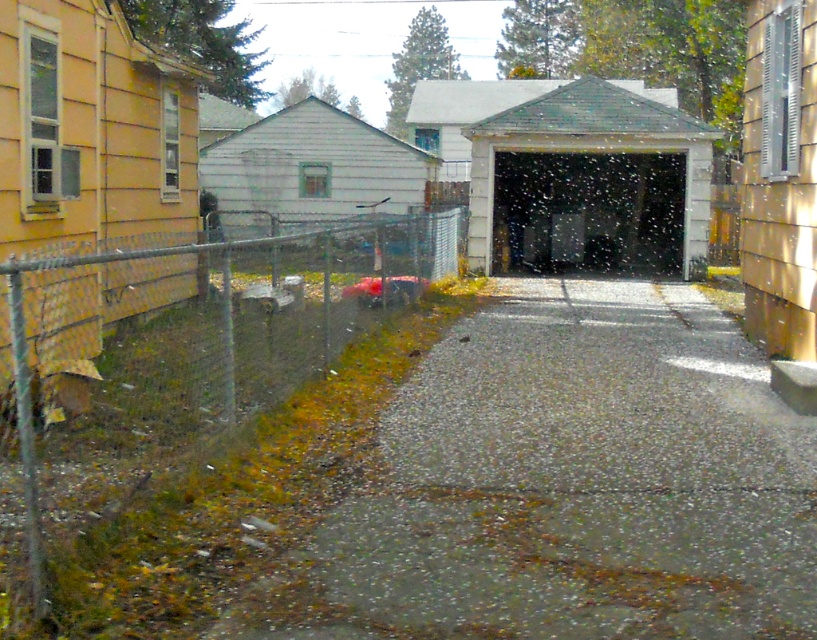
Does gravelly asphalt driveway at center appear under metal chain-link fence at left?

Indeed, gravelly asphalt driveway at center is positioned under metal chain-link fence at left.

Between gravelly asphalt driveway at center and metal chain-link fence at left, which one has less height?

gravelly asphalt driveway at center is shorter.

The image size is (817, 640). I want to click on gravelly asphalt driveway at center, so click(569, 484).

Locate an element on the screen. This screenshot has height=640, width=817. gravelly asphalt driveway at center is located at coordinates (569, 484).